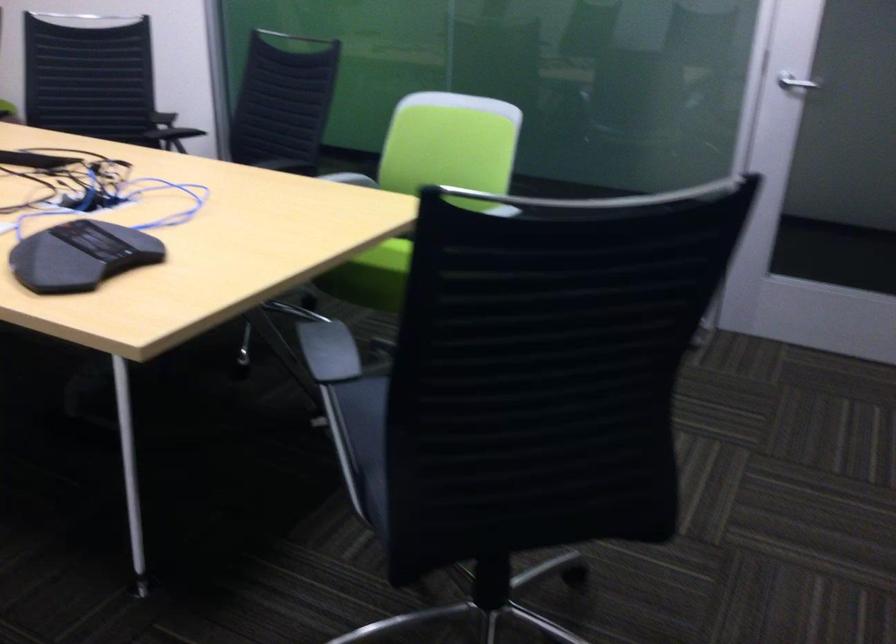
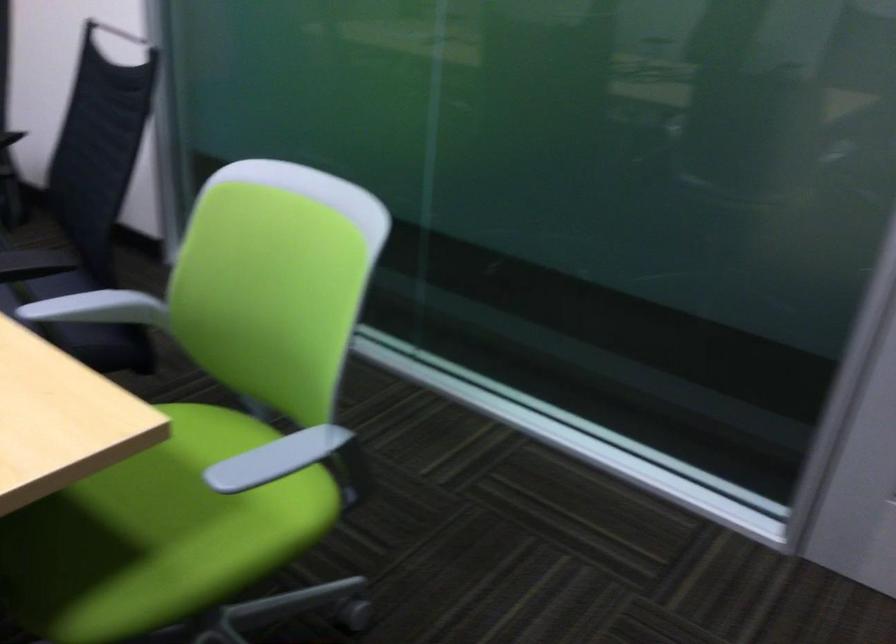
The point at [343,180] is marked in the first image. Where is the corresponding point in the second image?

(97, 308)